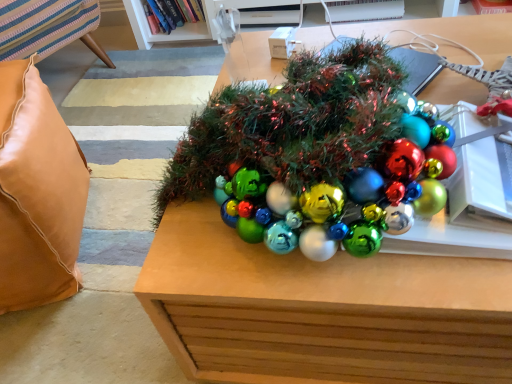
This screenshot has width=512, height=384. What do you see at coordinates (37, 193) in the screenshot?
I see `leather cushion at left` at bounding box center [37, 193].

At what (x,y) coordinates should I click in order to perform the action: click on metallic brown table at center, the second table in the top-to-bottom sequence. Please return your answer as a coordinate pair (x, y). This screenshot has width=512, height=384. Looking at the image, I should click on (321, 310).

How many degrees apart are the facing directions of shiny green tinsel at center, placed as the 1th table when sorted from top to bottom, and leather cushion at left?

The angle between the facing direction of shiny green tinsel at center, placed as the 1th table when sorted from top to bottom, and the facing direction of leather cushion at left is 142 degrees.

Visually, is shiny green tinsel at center, placed as the 1th table when sorted from top to bottom, positioned to the left or to the right of leather cushion at left?

In the image, shiny green tinsel at center, placed as the 1th table when sorted from top to bottom, appears on the right side of leather cushion at left.

From a real-world perspective, is shiny green tinsel at center, arranged as the second table when ordered from the bottom, above or below leather cushion at left?

Clearly, from a real-world perspective, shiny green tinsel at center, arranged as the second table when ordered from the bottom, is above leather cushion at left.

Is leather cushion at left inside shiny green tinsel at center, placed as the 1th table when sorted from top to bottom?

No, shiny green tinsel at center, placed as the 1th table when sorted from top to bottom, does not contain leather cushion at left.

Can you confirm if metallic brown table at center, positioned as the 1th table in bottom-to-top order, is smaller than hardcover book at upper center?

Actually, metallic brown table at center, positioned as the 1th table in bottom-to-top order, might be larger than hardcover book at upper center.

Which object is thinner, metallic brown table at center, positioned as the 1th table in bottom-to-top order, or hardcover book at upper center?

hardcover book at upper center.

The image size is (512, 384). There is a hardcover book at upper center. What are the coordinates of `the 2nd table below it (from the image's perspective)` in the screenshot? It's located at (321, 310).

Considering the relative positions of metallic brown table at center, positioned as the 1th table in bottom-to-top order, and hardcover book at upper center in the image provided, is metallic brown table at center, positioned as the 1th table in bottom-to-top order, to the left of hardcover book at upper center from the viewer's perspective?

In fact, metallic brown table at center, positioned as the 1th table in bottom-to-top order, is to the right of hardcover book at upper center.

Is hardcover book at upper center inside the boundaries of metallic brown table at center, the second table in the top-to-bottom sequence, or outside?

hardcover book at upper center is located beyond the bounds of metallic brown table at center, the second table in the top-to-bottom sequence.

Considering the relative sizes of hardcover book at upper center and metallic brown table at center, the second table in the top-to-bottom sequence, in the image provided, is hardcover book at upper center wider than metallic brown table at center, the second table in the top-to-bottom sequence,?

No, hardcover book at upper center is not wider than metallic brown table at center, the second table in the top-to-bottom sequence.

Considering the sizes of objects hardcover book at upper center and metallic brown table at center, positioned as the 1th table in bottom-to-top order, in the image provided, who is smaller, hardcover book at upper center or metallic brown table at center, positioned as the 1th table in bottom-to-top order,?

Smaller between the two is hardcover book at upper center.

From the image's perspective, is hardcover book at upper center positioned above or below metallic brown table at center, the second table in the top-to-bottom sequence?

hardcover book at upper center is above metallic brown table at center, the second table in the top-to-bottom sequence.

Is shiny green tinsel at center, placed as the 1th table when sorted from top to bottom, at the back of leather cushion at left?

leather cushion at left is not turned away from shiny green tinsel at center, placed as the 1th table when sorted from top to bottom.

Can you tell me how much leather cushion at left and shiny green tinsel at center, placed as the 1th table when sorted from top to bottom, differ in facing direction?

They differ by 142 degrees in their facing directions.

From a real-world perspective, is leather cushion at left positioned above or below shiny green tinsel at center, arranged as the second table when ordered from the bottom?

leather cushion at left is below shiny green tinsel at center, arranged as the second table when ordered from the bottom.

Who is bigger, leather cushion at left or shiny green tinsel at center, placed as the 1th table when sorted from top to bottom?

leather cushion at left.

How different are the orientations of metallic brown table at center, the second table in the top-to-bottom sequence, and leather cushion at left in degrees?

111 degrees.

Does point (313, 342) appear closer or farther from the camera than point (81, 155)?

Clearly, point (313, 342) is closer to the camera than point (81, 155).

Is metallic brown table at center, positioned as the 1th table in bottom-to-top order, to the left or to the right of leather cushion at left in the image?

Clearly, metallic brown table at center, positioned as the 1th table in bottom-to-top order, is on the right of leather cushion at left in the image.

Who is shorter, shiny green tinsel at center, arranged as the second table when ordered from the bottom, or metallic brown table at center, the second table in the top-to-bottom sequence?

shiny green tinsel at center, arranged as the second table when ordered from the bottom.

Would you say shiny green tinsel at center, arranged as the second table when ordered from the bottom, is inside or outside metallic brown table at center, the second table in the top-to-bottom sequence?

shiny green tinsel at center, arranged as the second table when ordered from the bottom, is not enclosed by metallic brown table at center, the second table in the top-to-bottom sequence.

From the image's perspective, does shiny green tinsel at center, placed as the 1th table when sorted from top to bottom, appear higher than metallic brown table at center, positioned as the 1th table in bottom-to-top order?

Yes, from the image's perspective, shiny green tinsel at center, placed as the 1th table when sorted from top to bottom, is above metallic brown table at center, positioned as the 1th table in bottom-to-top order.

Is shiny green tinsel at center, placed as the 1th table when sorted from top to bottom, turned away from metallic brown table at center, the second table in the top-to-bottom sequence?

No, shiny green tinsel at center, placed as the 1th table when sorted from top to bottom, is not facing away from metallic brown table at center, the second table in the top-to-bottom sequence.

Based on the photo, between hardcover book at upper center and leather cushion at left, which one is positioned in front?

leather cushion at left is more forward.

From the image's perspective, does hardcover book at upper center appear higher than leather cushion at left?

Yes, from the image's perspective, hardcover book at upper center is on top of leather cushion at left.

Where is `book behind the leather cushion at left`? book behind the leather cushion at left is located at coordinates click(x=172, y=14).

The image size is (512, 384). Identify the location of pillow below the shiny green tinsel at center, placed as the 1th table when sorted from top to bottom (from a real-world perspective). (x=37, y=193).

Where is `book behind the metallic brown table at center, the second table in the top-to-bottom sequence`? This screenshot has width=512, height=384. book behind the metallic brown table at center, the second table in the top-to-bottom sequence is located at coordinates (172, 14).

Based on their spatial positions, is leather cushion at left or metallic brown table at center, positioned as the 1th table in bottom-to-top order, closer to hardcover book at upper center?

Based on the image, leather cushion at left appears to be nearer to hardcover book at upper center.

Considering their positions, is hardcover book at upper center positioned further to shiny green tinsel at center, placed as the 1th table when sorted from top to bottom, than leather cushion at left?

hardcover book at upper center lies further to shiny green tinsel at center, placed as the 1th table when sorted from top to bottom, than the other object.

Looking at the image, which one is located closer to metallic brown table at center, the second table in the top-to-bottom sequence, shiny green tinsel at center, arranged as the second table when ordered from the bottom, or leather cushion at left?

Among the two, shiny green tinsel at center, arranged as the second table when ordered from the bottom, is located nearer to metallic brown table at center, the second table in the top-to-bottom sequence.

Estimate the real-world distances between objects in this image. Which object is further from leather cushion at left, metallic brown table at center, the second table in the top-to-bottom sequence, or hardcover book at upper center?

Based on the image, hardcover book at upper center appears to be further to leather cushion at left.

In the scene shown: Looking at the image, which one is located further to leather cushion at left, shiny green tinsel at center, arranged as the second table when ordered from the bottom, or metallic brown table at center, positioned as the 1th table in bottom-to-top order?

shiny green tinsel at center, arranged as the second table when ordered from the bottom, is further to leather cushion at left.

From the image, which object appears to be nearer to hardcover book at upper center, leather cushion at left or shiny green tinsel at center, placed as the 1th table when sorted from top to bottom?

shiny green tinsel at center, placed as the 1th table when sorted from top to bottom, is positioned closer to the anchor hardcover book at upper center.

Estimate the real-world distances between objects in this image. Which object is further from metallic brown table at center, positioned as the 1th table in bottom-to-top order, leather cushion at left or shiny green tinsel at center, placed as the 1th table when sorted from top to bottom?

leather cushion at left.

Which object lies further to the anchor point shiny green tinsel at center, placed as the 1th table when sorted from top to bottom, leather cushion at left or metallic brown table at center, the second table in the top-to-bottom sequence?

leather cushion at left is positioned further to the anchor shiny green tinsel at center, placed as the 1th table when sorted from top to bottom.

Where is `table located between metallic brown table at center, positioned as the 1th table in bottom-to-top order, and hardcover book at upper center in the depth direction`? The image size is (512, 384). table located between metallic brown table at center, positioned as the 1th table in bottom-to-top order, and hardcover book at upper center in the depth direction is located at coordinates (451, 33).

You are a GUI agent. You are given a task and a screenshot of the screen. Output one action in this format:
    pyautogui.click(x=<x>, y=<y>)
    Task: Click on the pillow located between metallic brown table at center, the second table in the top-to-bottom sequence, and hardcover book at upper center in the depth direction
    Image resolution: width=512 pixels, height=384 pixels.
    Given the screenshot: What is the action you would take?
    pyautogui.click(x=37, y=193)

The width and height of the screenshot is (512, 384). Find the location of `pillow between shiny green tinsel at center, placed as the 1th table when sorted from top to bottom, and hardcover book at upper center from front to back`. pillow between shiny green tinsel at center, placed as the 1th table when sorted from top to bottom, and hardcover book at upper center from front to back is located at coordinates (37, 193).

Find the location of a particular element. table situated between leather cushion at left and metallic brown table at center, the second table in the top-to-bottom sequence, from left to right is located at coordinates (451, 33).